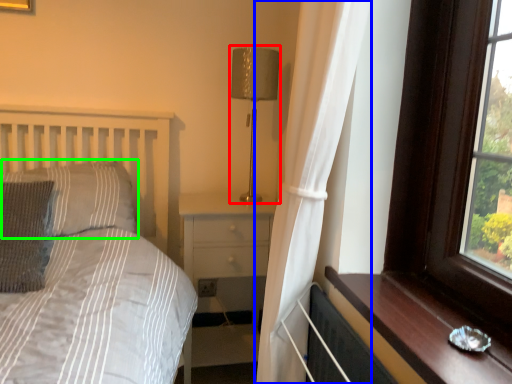
Question: Considering the real-world distances, which object is farthest from table lamp (highlighted by a red box)? curtain (highlighted by a blue box) or pillow (highlighted by a green box)?

Choices:
 (A) curtain
 (B) pillow

Answer: (B)